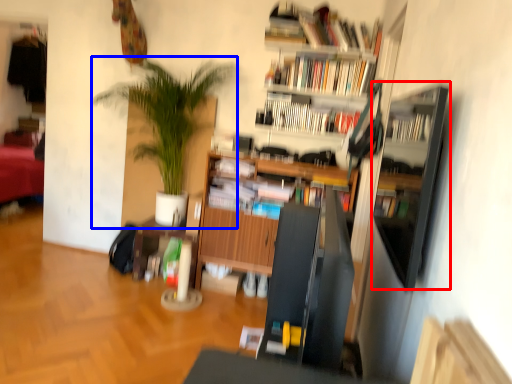
Question: Which point is further to the camera, shelf (highlighted by a red box) or houseplant (highlighted by a blue box)?

Choices:
 (A) shelf
 (B) houseplant

Answer: (B)